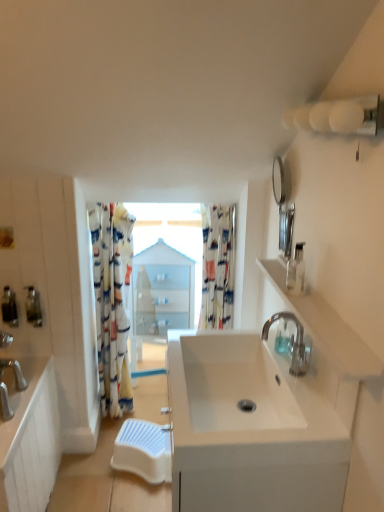
This screenshot has width=384, height=512. I want to click on vacant area in front of clear plastic soap dispenser at upper right, the first soap dispenser positioned from the front, so click(315, 306).